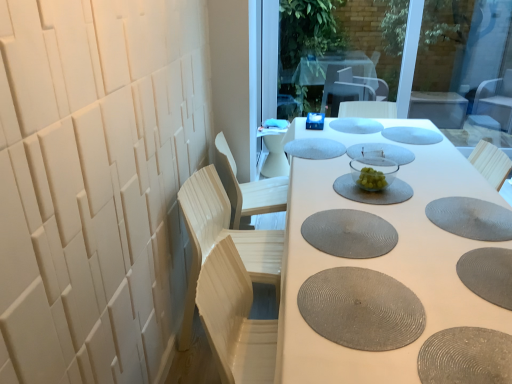
The image size is (512, 384). Identify the location of free space between light blue fabric cushion at center, placed as the 8th manhole cover when sorted from front to back, and clear glass bowl at center. (328, 168).